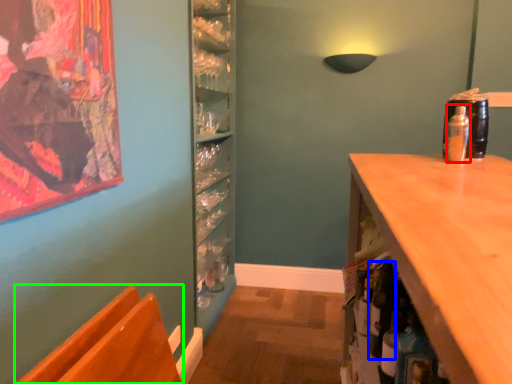
Question: Which is farther away from bottle (highlighted by a red box)? bottle (highlighted by a blue box) or chair (highlighted by a green box)?

Choices:
 (A) bottle
 (B) chair

Answer: (B)